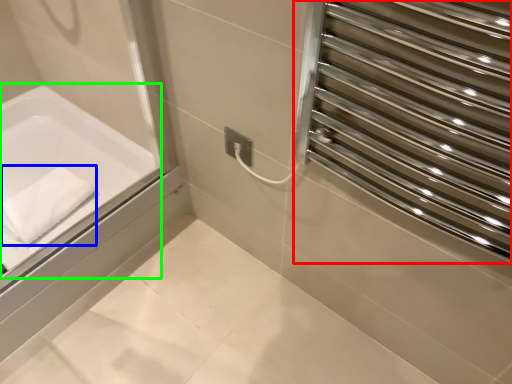
Question: Based on their relative distances, which object is nearer to screen door (highlighted by a red box)? Choose from bath towel (highlighted by a blue box) and bathtub (highlighted by a green box).

Choices:
 (A) bath towel
 (B) bathtub

Answer: (B)